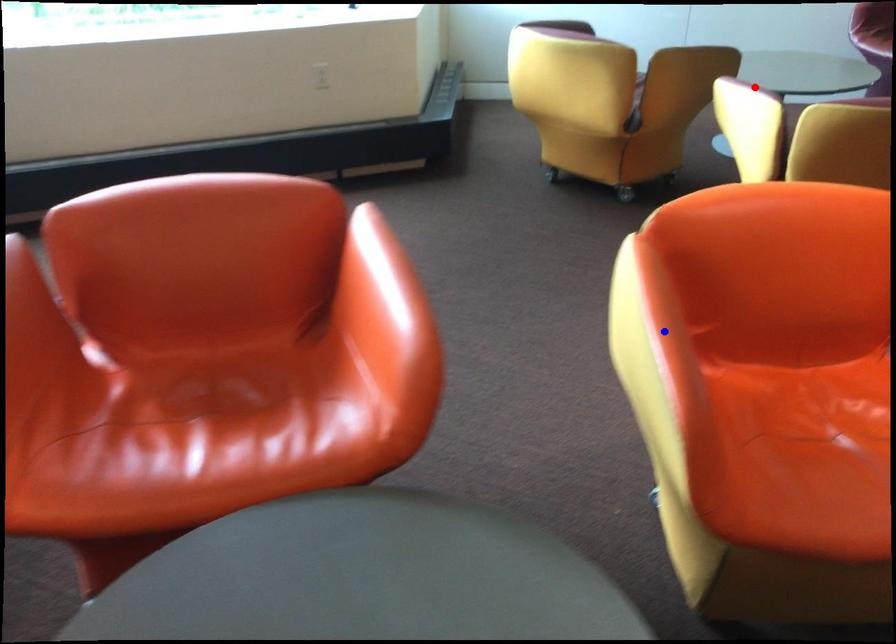
Question: In the image, two points are highlighted. Which point is nearer to the camera? Reply with the corresponding letter.

Choices:
 (A) blue point
 (B) red point

Answer: (A)